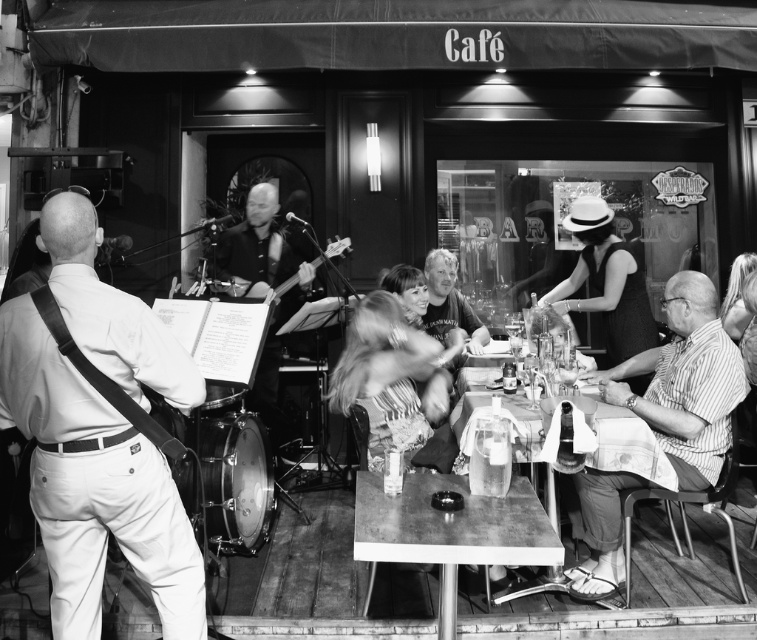
You are a photographer positioned at the entrance of the cafe. You want to take a photo of the striped cotton shirt at right and the wooden acoustic guitar at center. Which object should you adjust your camera angle to include first if you want to capture both in the frame?

The striped cotton shirt at right is to the right of the wooden acoustic guitar at center, so you should adjust your camera angle to include the wooden acoustic guitar at center first before capturing the striped cotton shirt at right.

You are standing at the entrance of the cafe and want to take a photo of a specific point in the scene. The point you want to capture is located at coordinates point (117, 444). Given that your camera has a depth of field that can focus clearly on objects within 2.5 meters, will the point be in focus?

The distance of point (117, 444) from the camera is 2.66 meters, which is beyond the camera focus range of 2.5 meters. Therefore, the point will not be in focus.

You are a photographer standing at the entrance of the cafe. You want to take a photo of the striped cotton shirt at right and the wooden acoustic guitar at center. Which object should you focus on first if you want to capture both in the same frame without moving the camera?

The striped cotton shirt at right is much taller than the wooden acoustic guitar at center, so you should focus on the striped cotton shirt at right first to ensure it fits within the frame.